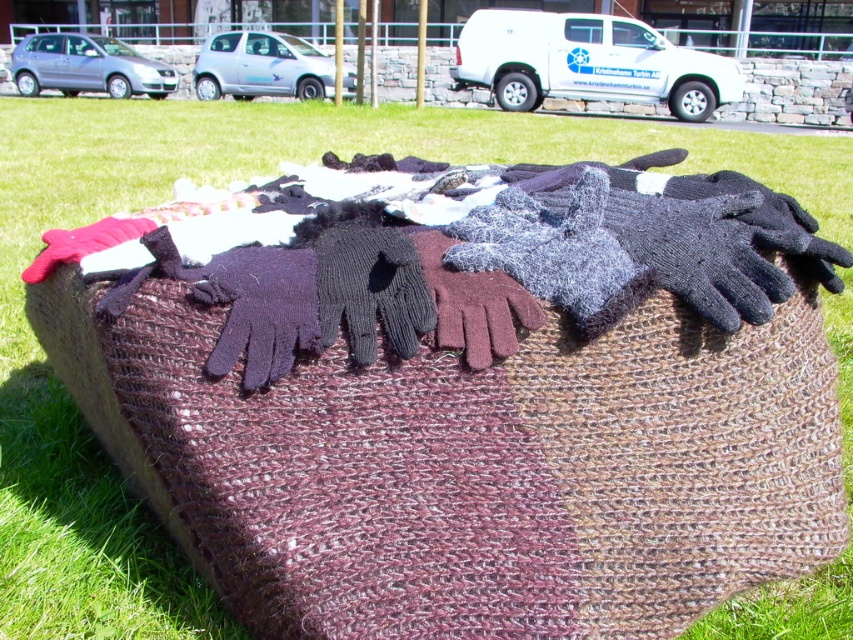
You are standing above the mat and want to place a new black scarf exactly at the center of the mat. Is the gray knitted gloves at center currently in the way?

The gray knitted gloves at center is located at point (555, 252), which is not exactly the center of the mat. Therefore, placing the black scarf at the exact center would not interfere with the gray knitted gloves at center.

You are organizing a winter clothing display and need to place a new pair of black mittens between the gray knitted gloves at center and the maroon knitted glove at center. Based on their current positions, where should you position the black mittens?

Since the gray knitted gloves at center are to the right of the maroon knitted glove at center, you should place the black mittens between them, positioning the black mittens to the right of the maroon knitted glove at center and to the left of the gray knitted gloves at center.

You are organizing a winter clothing drive and need to determine which item takes up more space. Which item is bigger between the gray knitted gloves at center and the maroon knitted glove at center?

The gray knitted gloves at center is larger in size than the maroon knitted glove at center, so it takes up more space.